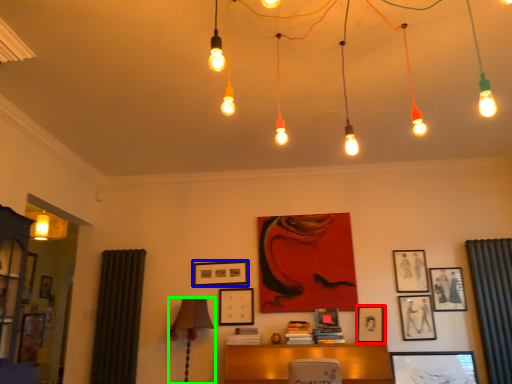
Question: Which object is positioned farthest from picture frame (highlighted by a red box)? Select from picture frame (highlighted by a blue box) and table lamp (highlighted by a green box).

Choices:
 (A) picture frame
 (B) table lamp

Answer: (B)